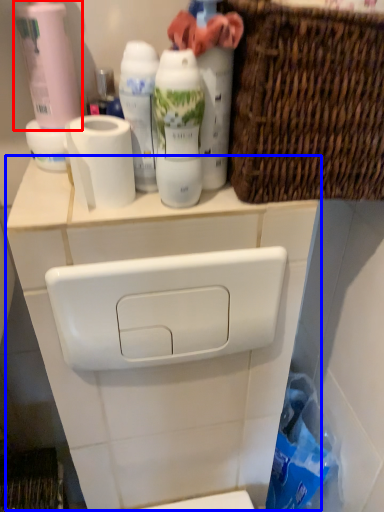
Question: Which of the following is the closest to the observer, cleaning product (highlighted by a red box) or counter (highlighted by a blue box)?

Choices:
 (A) cleaning product
 (B) counter

Answer: (A)